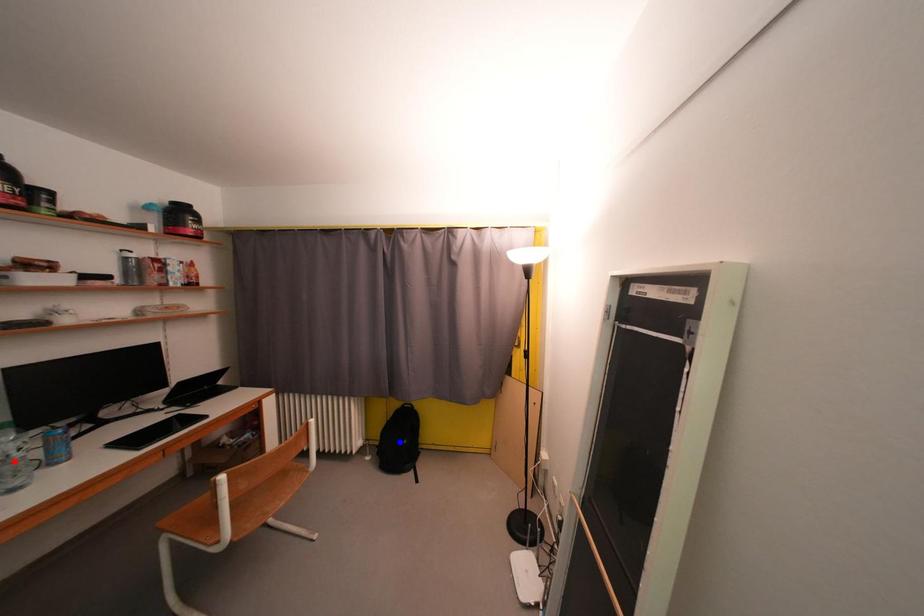
Question: In the image, two points are highlighted. Which point is nearer to the camera? Reply with the corresponding letter.

Choices:
 (A) blue point
 (B) red point

Answer: (B)